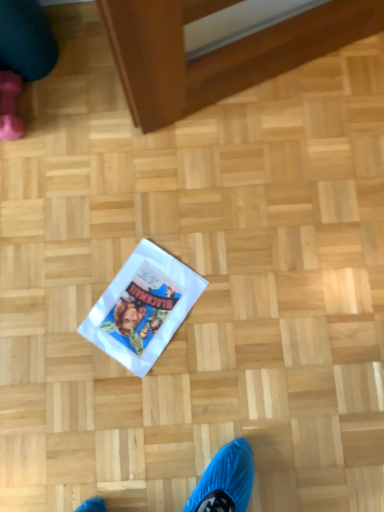
Question: Should I look upward or downward to see pink rubber boot at upper left?

Choices:
 (A) up
 (B) down

Answer: (A)

Question: Considering the relative positions of white paper flyer at center and teal fabric leg at upper left in the image provided, is white paper flyer at center to the left of teal fabric leg at upper left from the viewer's perspective?

Choices:
 (A) no
 (B) yes

Answer: (A)

Question: Is white paper flyer at center next to teal fabric leg at upper left?

Choices:
 (A) no
 (B) yes

Answer: (A)

Question: Is there a large distance between white paper flyer at center and teal fabric leg at upper left?

Choices:
 (A) no
 (B) yes

Answer: (A)

Question: Could you tell me if white paper flyer at center is turned towards teal fabric leg at upper left?

Choices:
 (A) no
 (B) yes

Answer: (A)

Question: Does white paper flyer at center have a greater height compared to teal fabric leg at upper left?

Choices:
 (A) no
 (B) yes

Answer: (A)

Question: Could teal fabric leg at upper left be considered to be inside white paper flyer at center?

Choices:
 (A) yes
 (B) no

Answer: (B)

Question: Is teal fabric leg at upper left touching pink rubber boot at upper left?

Choices:
 (A) no
 (B) yes

Answer: (B)

Question: Can you confirm if teal fabric leg at upper left is thinner than pink rubber boot at upper left?

Choices:
 (A) no
 (B) yes

Answer: (A)

Question: Is teal fabric leg at upper left smaller than pink rubber boot at upper left?

Choices:
 (A) yes
 (B) no

Answer: (B)

Question: Is pink rubber boot at upper left located within teal fabric leg at upper left?

Choices:
 (A) no
 (B) yes

Answer: (A)

Question: Is teal fabric leg at upper left not near pink rubber boot at upper left?

Choices:
 (A) no
 (B) yes

Answer: (A)

Question: From a real-world perspective, is teal fabric leg at upper left on top of pink rubber boot at upper left?

Choices:
 (A) no
 (B) yes

Answer: (B)

Question: From the image's perspective, does teal fabric leg at upper left appear lower than white paper flyer at center?

Choices:
 (A) yes
 (B) no

Answer: (B)